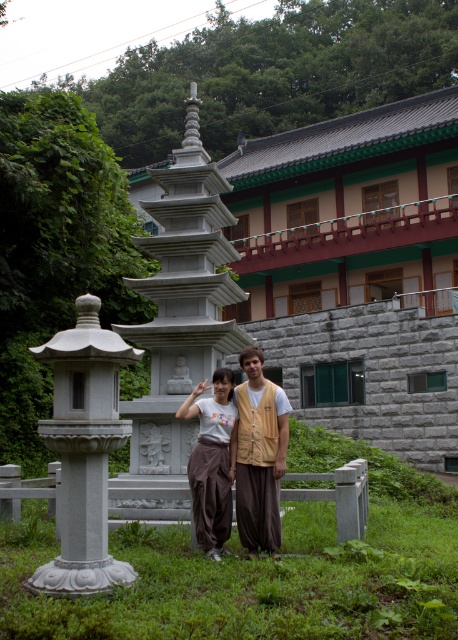
Between point (85, 588) and point (211, 534), which one is positioned in front?

Point (85, 588) is in front.

Which of these two, white stone lantern at left or matte white pants at center, stands taller?

white stone lantern at left is taller.

At what (x,y) coordinates should I click in order to perform the action: click on white stone lantern at left. Please return your answer as a coordinate pair (x, y). Looking at the image, I should click on 83,451.

Can you confirm if white stone lantern at left is shorter than brown cotton pants at center?

In fact, white stone lantern at left may be taller than brown cotton pants at center.

Does white stone lantern at left have a larger size compared to brown cotton pants at center?

Actually, white stone lantern at left might be smaller than brown cotton pants at center.

Is point (114, 371) behind point (276, 472)?

No, it is not.

Find the location of `white stone lantern at left`. white stone lantern at left is located at coordinates (83, 451).

Does brown cotton pants at center lie behind matte white pants at center?

Yes, brown cotton pants at center is behind matte white pants at center.

Which is above, brown cotton pants at center or matte white pants at center?

brown cotton pants at center is above.

Is point (254, 406) positioned after point (211, 544)?

That is True.

The height and width of the screenshot is (640, 458). I want to click on brown cotton pants at center, so click(259, 452).